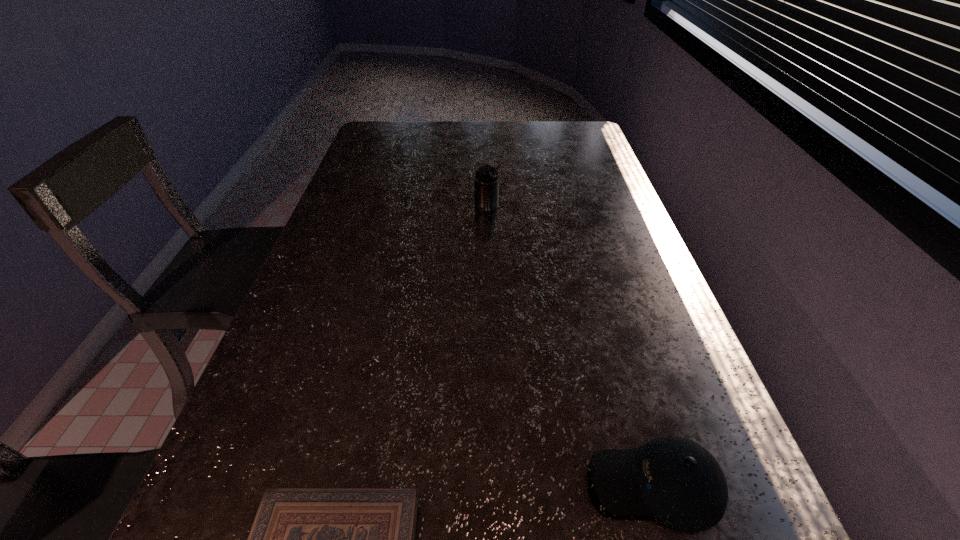
Where is `the farthest object`? Image resolution: width=960 pixels, height=540 pixels. the farthest object is located at coordinates [486, 180].

I want to click on the tallest object, so click(x=486, y=180).

The image size is (960, 540). Identify the location of baseball cap. (674, 479).

Where is `the second shortest object`? the second shortest object is located at coordinates (674, 479).

The height and width of the screenshot is (540, 960). In order to click on vacant space located on the left of the can in this screenshot , I will do `click(351, 205)`.

The height and width of the screenshot is (540, 960). I want to click on blank space located on the front-facing side of the rightmost object, so click(x=519, y=483).

Where is `blank space located 0.210m on the front-facing side of the rightmost object`? This screenshot has height=540, width=960. blank space located 0.210m on the front-facing side of the rightmost object is located at coordinates (456, 483).

Identify the location of free spot located on the front-facing side of the rightmost object. (380, 483).

I want to click on object that is positioned at the right edge, so click(x=674, y=479).

I want to click on free region at the far edge of the desktop, so click(x=420, y=139).